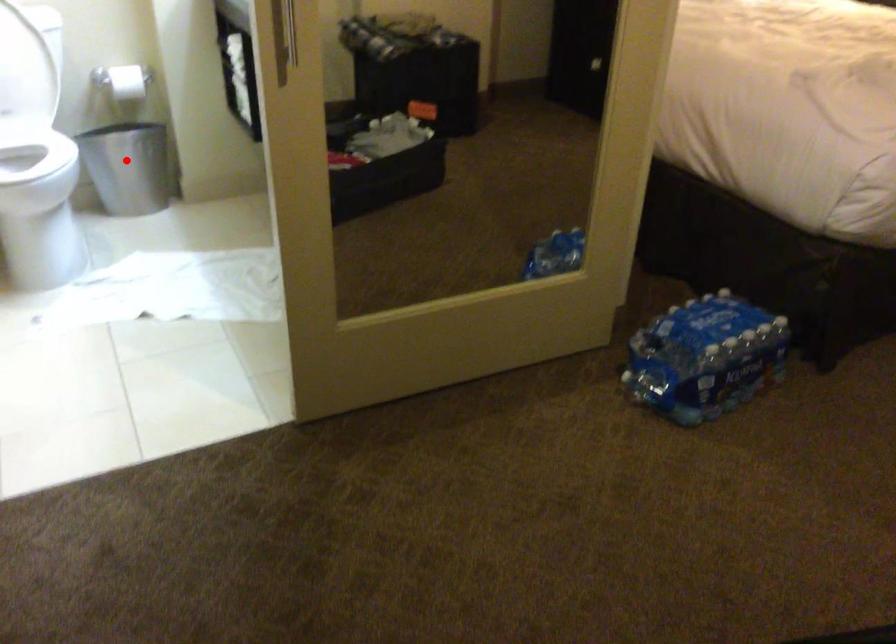
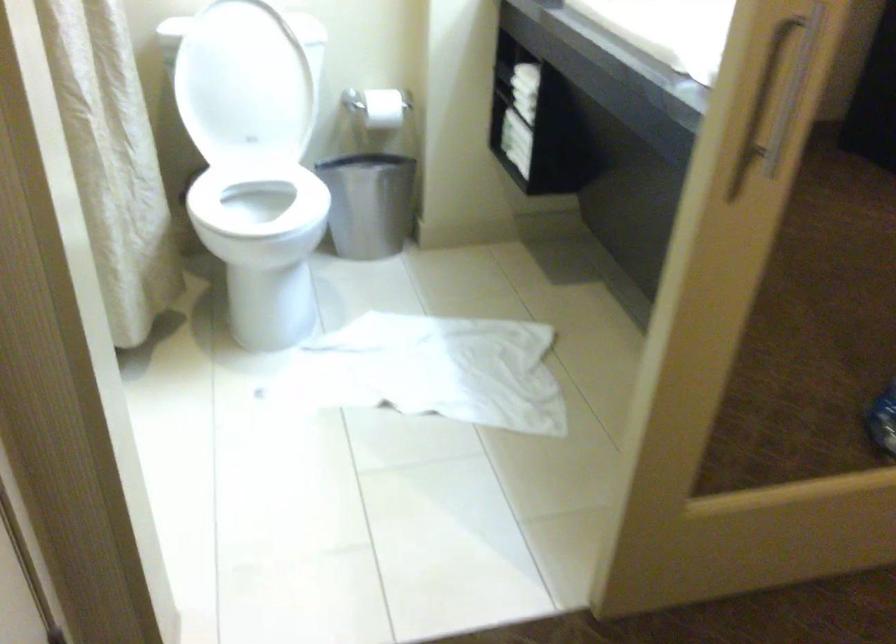
Question: I am providing you with two images of the same scene from different viewpoints. In image1, a red point is highlighted. Considering the same 3D point in image2, which of the following is correct?

Choices:
 (A) It is closer
 (B) It is farther

Answer: (A)